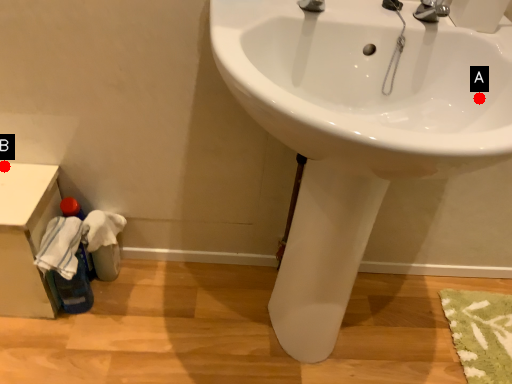
Question: Two points are circled on the image, labeled by A and B beside each circle. Which point is farther to the camera?

Choices:
 (A) A is further
 (B) B is further

Answer: (B)